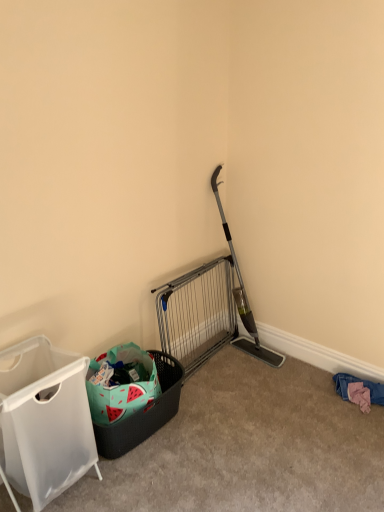
Question: Does silver metallic gate at center lie behind white fabric laundry basket at left?

Choices:
 (A) yes
 (B) no

Answer: (A)

Question: Can you confirm if silver metallic gate at center is thinner than white fabric laundry basket at left?

Choices:
 (A) yes
 (B) no

Answer: (A)

Question: Can you confirm if silver metallic gate at center is taller than white fabric laundry basket at left?

Choices:
 (A) yes
 (B) no

Answer: (B)

Question: Does silver metallic gate at center touch white fabric laundry basket at left?

Choices:
 (A) no
 (B) yes

Answer: (A)

Question: Is silver metallic gate at center at the left side of white fabric laundry basket at left?

Choices:
 (A) yes
 (B) no

Answer: (B)

Question: Considering the relative positions of silver metallic gate at center and white fabric laundry basket at left in the image provided, is silver metallic gate at center to the right of white fabric laundry basket at left from the viewer's perspective?

Choices:
 (A) no
 (B) yes

Answer: (B)

Question: Considering the relative positions of silver metallic gate at center and pink fabric at lower right in the image provided, is silver metallic gate at center behind pink fabric at lower right?

Choices:
 (A) yes
 (B) no

Answer: (B)

Question: From the image's perspective, is silver metallic gate at center located beneath pink fabric at lower right?

Choices:
 (A) yes
 (B) no

Answer: (B)

Question: From a real-world perspective, does silver metallic gate at center sit lower than pink fabric at lower right?

Choices:
 (A) no
 (B) yes

Answer: (A)

Question: Is pink fabric at lower right surrounded by silver metallic gate at center?

Choices:
 (A) yes
 (B) no

Answer: (B)

Question: Could you tell me if silver metallic gate at center is facing pink fabric at lower right?

Choices:
 (A) yes
 (B) no

Answer: (A)

Question: Is silver metallic gate at center thinner than pink fabric at lower right?

Choices:
 (A) yes
 (B) no

Answer: (B)

Question: Can you confirm if watermelon-patterned plastic basket at lower left is taller than silver metallic gate at center?

Choices:
 (A) yes
 (B) no

Answer: (B)